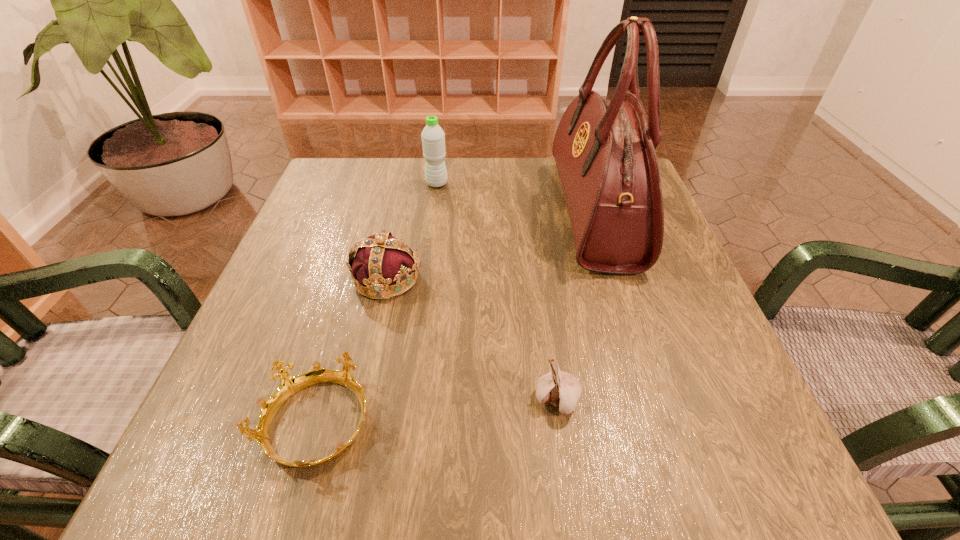
This screenshot has height=540, width=960. I want to click on free space located 0.370m on the front-facing side of the tallest object, so click(x=397, y=212).

The image size is (960, 540). Find the location of `free space located 0.080m on the front-facing side of the tallest object`. free space located 0.080m on the front-facing side of the tallest object is located at coordinates (524, 212).

Find the location of a particular element. The image size is (960, 540). blank space located on the front of the second tallest object is located at coordinates (432, 222).

Locate an element on the screen. This screenshot has height=540, width=960. blank space located 0.280m on the front of the third shortest object is located at coordinates (348, 454).

Locate an element on the screen. free space located on the left of the garlic is located at coordinates (395, 400).

In order to click on vacant region located 0.260m on the right of the nearer crown in this screenshot , I will do `click(556, 424)`.

You are a GUI agent. You are given a task and a screenshot of the screen. Output one action in this format:
    pyautogui.click(x=<x>, y=<y>)
    Task: Click on the handbag at the far edge
    The width and height of the screenshot is (960, 540).
    Given the screenshot: What is the action you would take?
    pyautogui.click(x=604, y=150)

The width and height of the screenshot is (960, 540). Find the location of `water bottle present at the far edge`. water bottle present at the far edge is located at coordinates (433, 137).

The width and height of the screenshot is (960, 540). Find the location of `object located in the near edge section of the desktop`. object located in the near edge section of the desktop is located at coordinates (289, 385).

The height and width of the screenshot is (540, 960). In order to click on object at the right edge in this screenshot , I will do `click(604, 150)`.